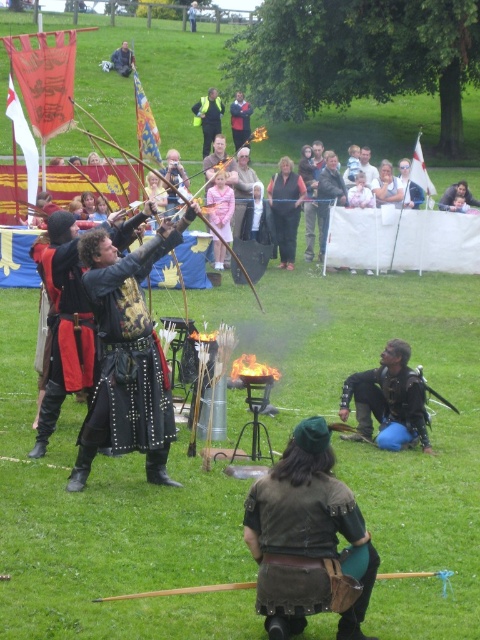
Is black leather armor at center positioned at the back of yellow reflective vest at center?

No.

Is black leather armor at center above yellow reflective vest at center?

Actually, black leather armor at center is below yellow reflective vest at center.

Measure the distance between black leather armor at center and camera.

black leather armor at center is 10.59 meters from camera.

At what (x,y) coordinates should I click in order to perform the action: click on black leather armor at center. Please return your answer as a coordinate pair (x, y). Looking at the image, I should click on (128, 356).

Does leather armor at lower right come behind smooth skin face at upper right?

No, it is in front of smooth skin face at upper right.

Is leather armor at lower right to the right of smooth skin face at upper right from the viewer's perspective?

No, leather armor at lower right is not to the right of smooth skin face at upper right.

Is point (379, 401) farther from viewer compared to point (458, 202)?

No, it is not.

You are a GUI agent. You are given a task and a screenshot of the screen. Output one action in this format:
    pyautogui.click(x=<x>, y=<y>)
    Task: Click on the leather armor at lower right
    The width and height of the screenshot is (480, 640).
    Given the screenshot: What is the action you would take?
    pyautogui.click(x=387, y=401)

Who is higher up, leather armor at lower right or leather jacket at upper center?

leather jacket at upper center is higher up.

Does leather armor at lower right have a larger size compared to leather jacket at upper center?

No, leather armor at lower right is not bigger than leather jacket at upper center.

Is point (376, 394) positioned before point (112, 58)?

Yes, it is.

Find the location of a particular element. This screenshot has height=640, width=480. leather armor at lower right is located at coordinates (387, 401).